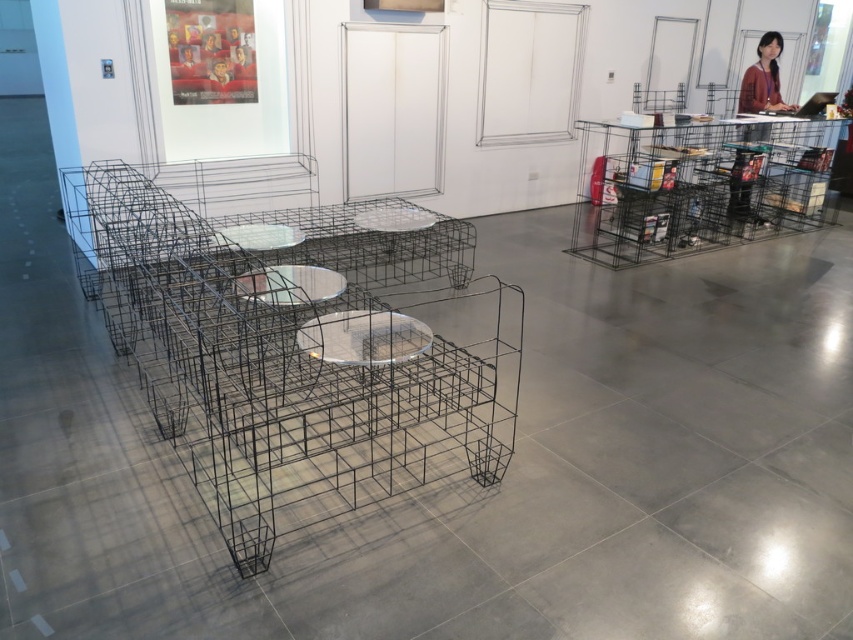
Question: Does matte black jacket at upper right have a smaller size compared to clear glass table at center?

Choices:
 (A) yes
 (B) no

Answer: (B)

Question: Is transparent glass table at center closer to camera compared to clear glass table at center?

Choices:
 (A) no
 (B) yes

Answer: (B)

Question: Which is nearer to the clear glass table at center?

Choices:
 (A) transparent glass table at center
 (B) matte black jacket at upper right

Answer: (A)

Question: Is matte black jacket at upper right positioned behind clear glass table at center?

Choices:
 (A) no
 (B) yes

Answer: (B)

Question: Which object appears closest to the camera in this image?

Choices:
 (A) clear glass table at center
 (B) matte black jacket at upper right

Answer: (A)

Question: Which point is closer to the camera?

Choices:
 (A) (306, 268)
 (B) (399, 316)
 (C) (737, 196)

Answer: (B)